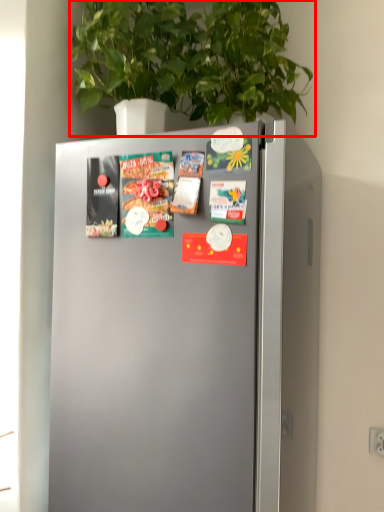
Question: From the image's perspective, where is houseplant (annotated by the red box) located relative to magazine?

Choices:
 (A) below
 (B) above

Answer: (B)